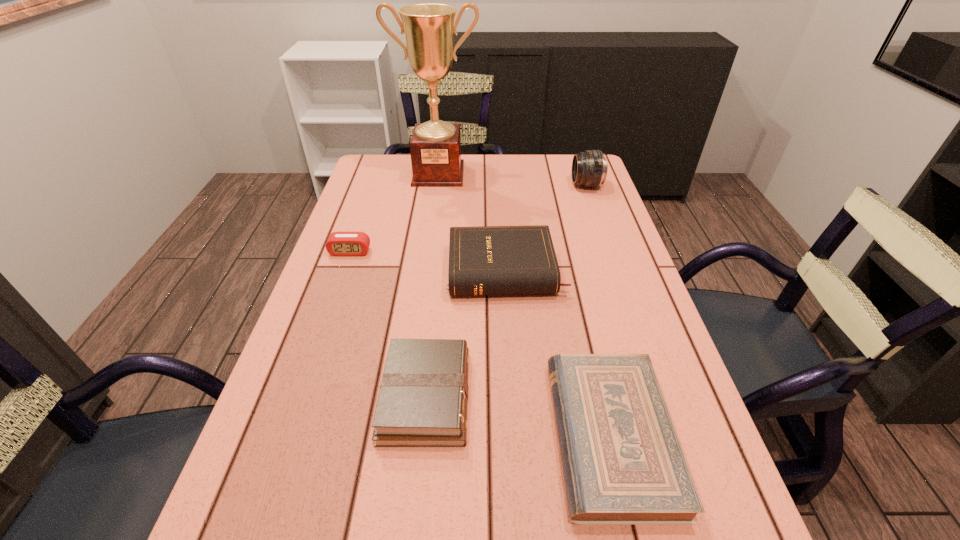
You are a GUI agent. You are given a task and a screenshot of the screen. Output one action in this format:
    pyautogui.click(x=<x>, y=<y>)
    Task: Click on the second closest Bible to the second tallest Bible
    
    Given the screenshot: What is the action you would take?
    pyautogui.click(x=623, y=464)

The width and height of the screenshot is (960, 540). Identify the location of Bible that can be found as the third closest to the tallest object. (623, 464).

Find the location of a particular element. This screenshot has height=540, width=960. vacant space that satisfies the following two spatial constraints: 1. on the front-facing side of the fourth shortest object; 2. on the right side of the leftmost object is located at coordinates (344, 271).

In order to click on vacant region that satisfies the following two spatial constraints: 1. on the plaque of the trophy cup; 2. on the right side of the farthest Bible in this screenshot , I will do `click(425, 271)`.